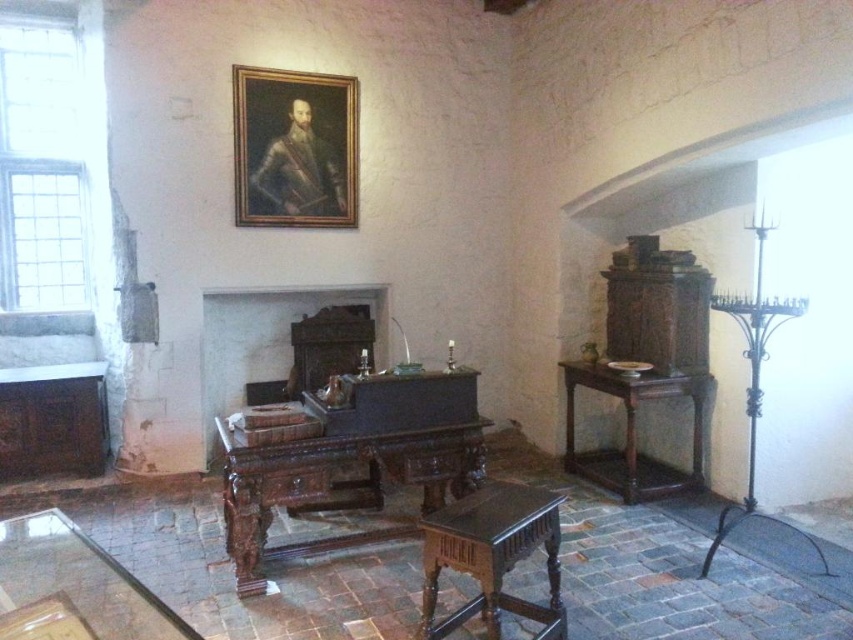
Question: Observing the image, what is the correct spatial positioning of wooden frame at upper center in reference to dark wood side table at right?

Choices:
 (A) below
 (B) above

Answer: (B)

Question: Can you confirm if dark wood fireplace at center is thinner than dark wood side table at right?

Choices:
 (A) no
 (B) yes

Answer: (A)

Question: Does dark wood carved table at center have a larger size compared to dark wood fireplace at center?

Choices:
 (A) no
 (B) yes

Answer: (A)

Question: Considering the real-world distances, which object is closest to the dark wood carved table at center?

Choices:
 (A) translucent glass table at lower left
 (B) dark brown wood stool at center
 (C) dark wood side table at right

Answer: (B)

Question: Estimate the real-world distances between objects in this image. Which object is closer to the dark wood carved table at center?

Choices:
 (A) wooden frame at upper center
 (B) translucent glass table at lower left

Answer: (B)

Question: Which point appears farthest from the camera in this image?

Choices:
 (A) coord(260,124)
 (B) coord(556,609)

Answer: (A)